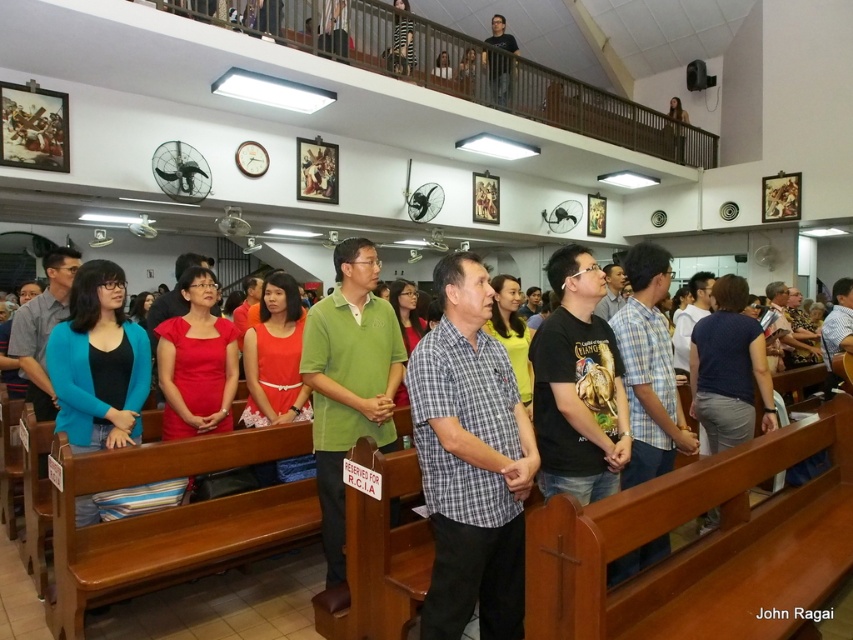
Can you confirm if gray checkered shirt at center is wider than black matte shirt at upper center?

Yes, gray checkered shirt at center is wider than black matte shirt at upper center.

Locate an element on the screen. This screenshot has height=640, width=853. gray checkered shirt at center is located at coordinates (469, 460).

Locate an element on the screen. gray checkered shirt at center is located at coordinates (469, 460).

Locate an element on the screen. gray checkered shirt at center is located at coordinates (469, 460).

Which is in front, point (451, 298) or point (354, 314)?

Point (451, 298) is more forward.

Between gray checkered shirt at center and green matte shirt at center, which one has more height?

green matte shirt at center is taller.

This screenshot has width=853, height=640. In order to click on gray checkered shirt at center in this screenshot , I will do `click(469, 460)`.

Who is more forward, (325, 538) or (490, 42)?

Point (325, 538) is in front.

Is point (331, 321) farther from camera compared to point (508, 36)?

No, (331, 321) is closer to viewer.

Identify the location of green matte shirt at center. This screenshot has height=640, width=853. (349, 381).